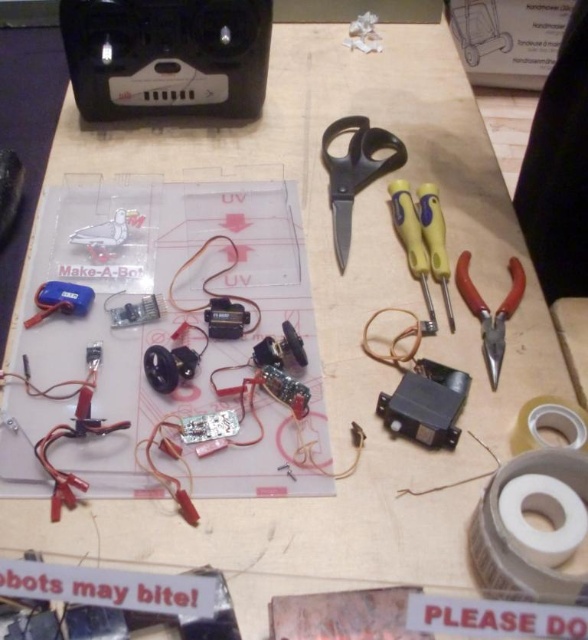
You are working on a robotics project and need to cut a wire that is near the PCB. The black plastic scissors at center are located at coordinates 0.269, 0.604. If the wire is at position 0.25, 0.65, can you reach the wire with the scissors without moving them?

The black plastic scissors at center are at coordinates (x=355, y=172). The wire is at (x=382, y=160). The distance between them is calculated using the distance formula sqrt. Since the distance is less than the maximum reach of the scissors, you can reach the wire without moving the scissors.

You are working on assembling a robot kit and need to pick up the black plastic scissors at center and the yellow plastic screwdriver at right. How far apart are these two tools?

The distance between the black plastic scissors at center and the yellow plastic screwdriver at right is 3.53 inches.